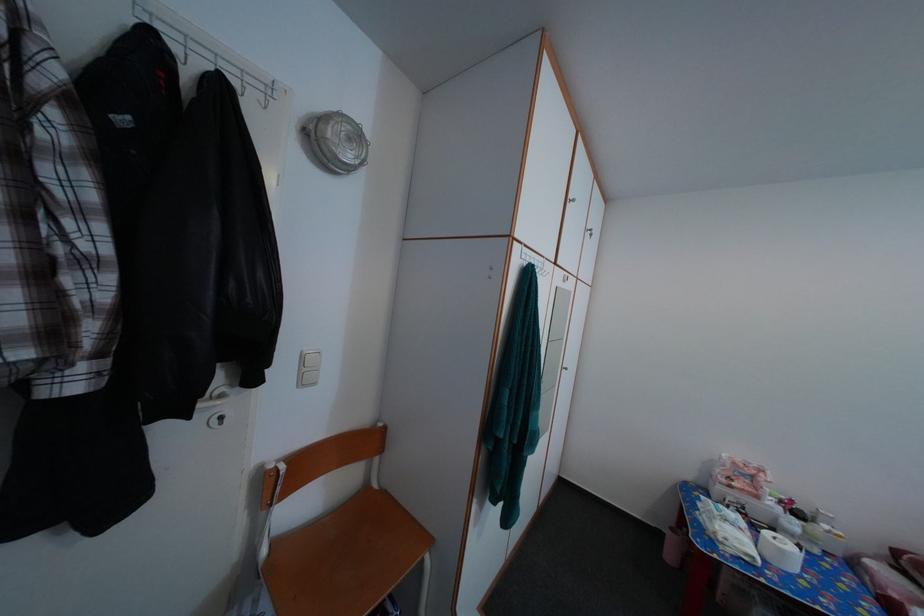
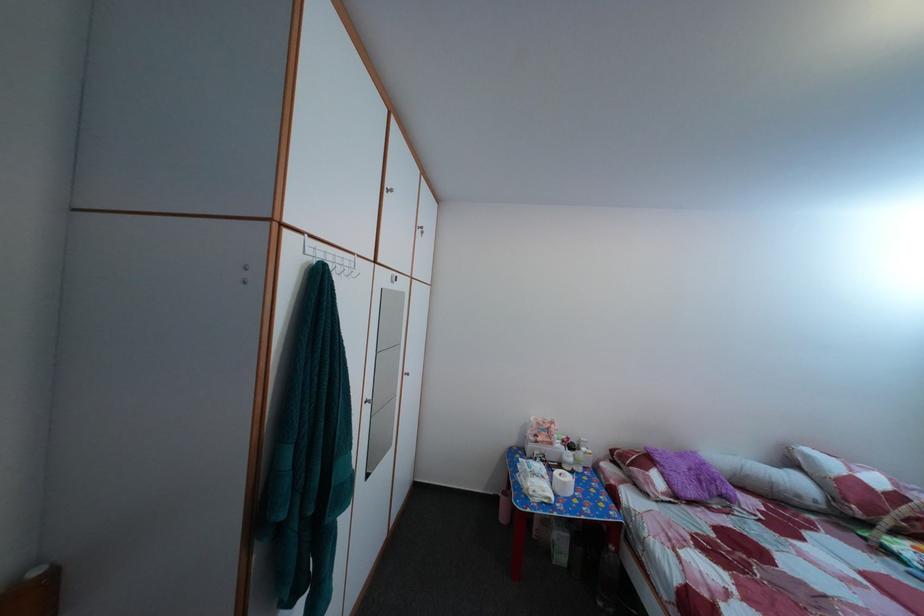
The point at [550,273] is marked in the first image. Where is the corresponding point in the second image?

(356, 270)